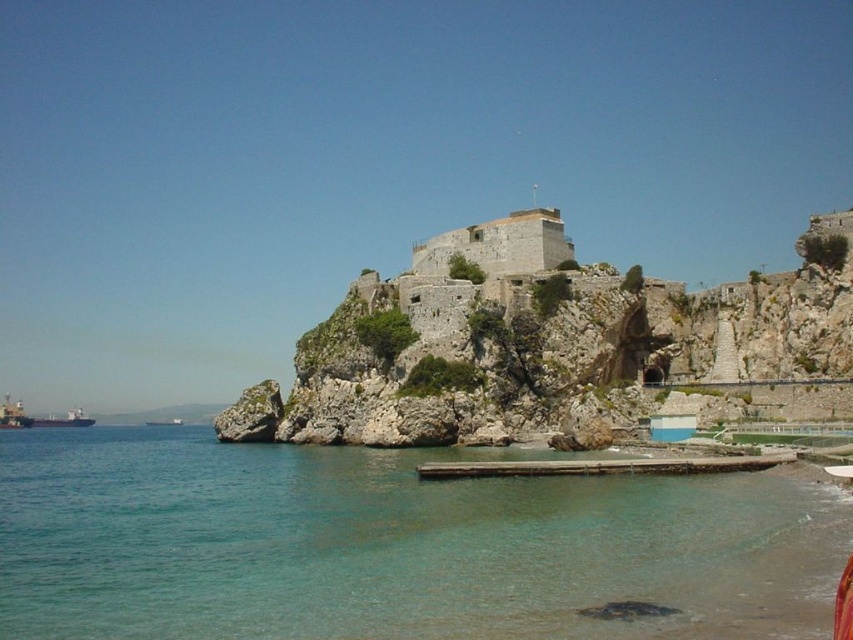
Question: Which object is closer to the camera taking this photo?

Choices:
 (A) clear water at lower left
 (B) metallic gray ship at left

Answer: (A)

Question: Can you confirm if green matte cargo ship at lower left is positioned to the right of metallic gray ship at left?

Choices:
 (A) yes
 (B) no

Answer: (B)

Question: Can you confirm if clear water at lower left is smaller than metallic gray ship at left?

Choices:
 (A) no
 (B) yes

Answer: (A)

Question: Is green matte cargo ship at lower left smaller than metallic gray ship at left?

Choices:
 (A) no
 (B) yes

Answer: (A)

Question: Which object is positioned farthest from the metallic gray ship at left?

Choices:
 (A) clear water at lower left
 (B) green matte cargo ship at lower left

Answer: (A)

Question: Which point appears closest to the camera in this image?

Choices:
 (A) (67, 419)
 (B) (158, 424)
 (C) (711, 522)

Answer: (C)